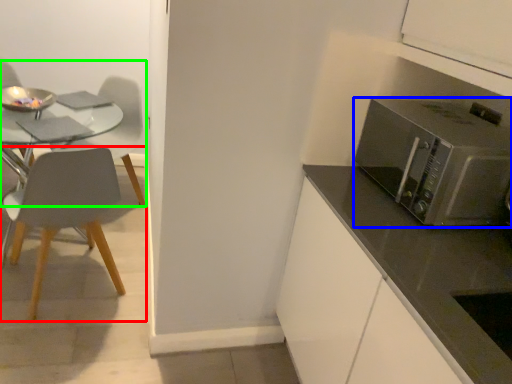
Question: Estimate the real-world distances between objects in this image. Which object is farther from chair (highlighted by a red box), microwave oven (highlighted by a blue box) or chair (highlighted by a green box)?

Choices:
 (A) microwave oven
 (B) chair

Answer: (A)